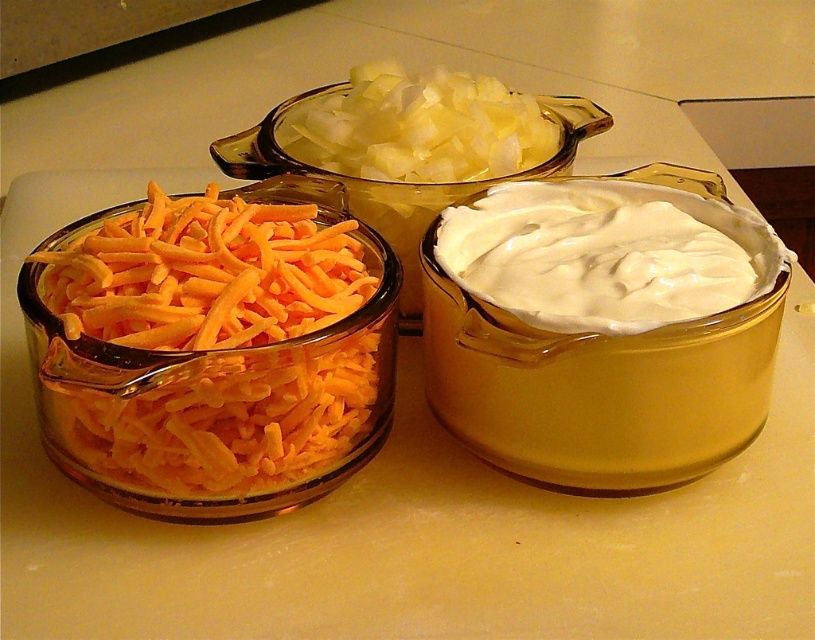
Is orange shredded cheese at lower left wider than white creamy spread at center?

Yes, orange shredded cheese at lower left is wider than white creamy spread at center.

Between point (173, 422) and point (604, 272), which one is positioned behind?

The point (604, 272) is more distant.

Find the location of `orange shredded cheese at lower left`. orange shredded cheese at lower left is located at coordinates (212, 340).